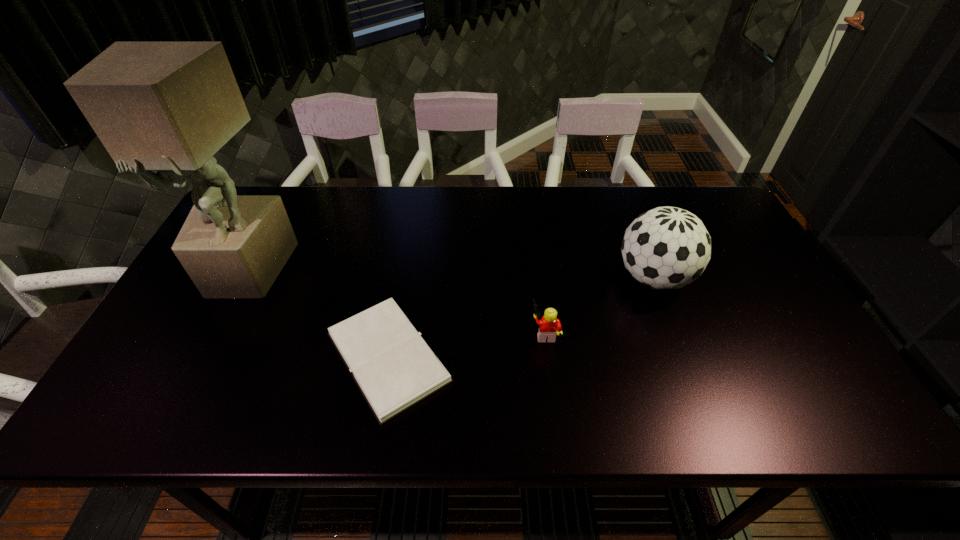
Find the location of a particular element. This screenshot has width=960, height=540. free region located in front of the second object from right to left with the accessory visible is located at coordinates (458, 333).

What are the coordinates of `vacant point located in front of the second object from right to left with the accessory visible` in the screenshot? It's located at (458, 333).

Image resolution: width=960 pixels, height=540 pixels. I want to click on free spot located 0.250m in front of the second object from right to left with the accessory visible, so click(430, 333).

The width and height of the screenshot is (960, 540). Identify the location of vacant space situated 0.350m on the back of the shortest object. (412, 219).

Locate an element on the screen. The height and width of the screenshot is (540, 960). object that is at the near edge is located at coordinates (394, 368).

I want to click on object that is at the left edge, so click(x=168, y=107).

The width and height of the screenshot is (960, 540). I want to click on free space at the far edge of the desktop, so click(601, 214).

Where is `vacant area at the near edge`? The width and height of the screenshot is (960, 540). vacant area at the near edge is located at coordinates (516, 425).

This screenshot has width=960, height=540. In the image, there is a desktop. Find the location of `vacant space at the left edge`. vacant space at the left edge is located at coordinates (228, 306).

In the image, there is a desktop. Where is `vacant space at the right edge`? The height and width of the screenshot is (540, 960). vacant space at the right edge is located at coordinates (734, 253).